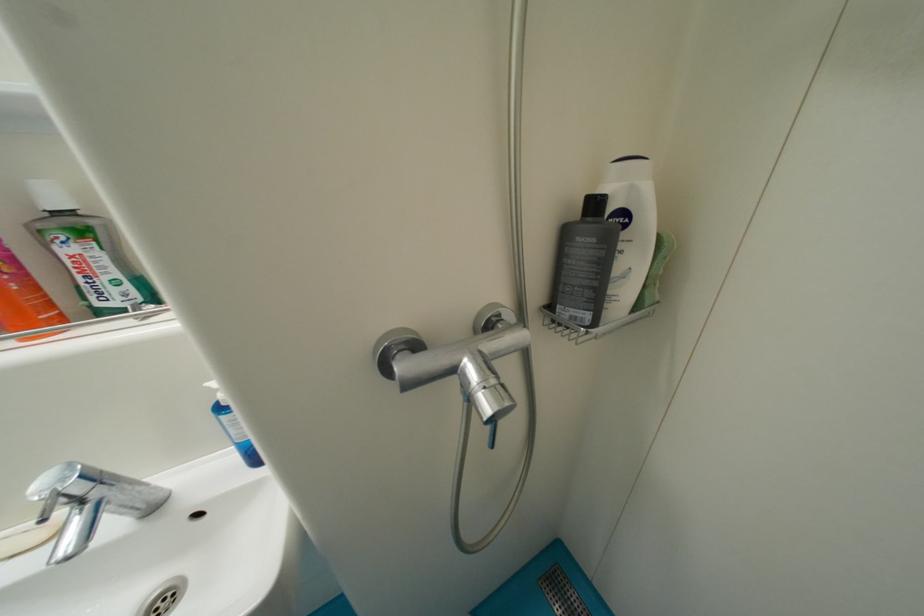
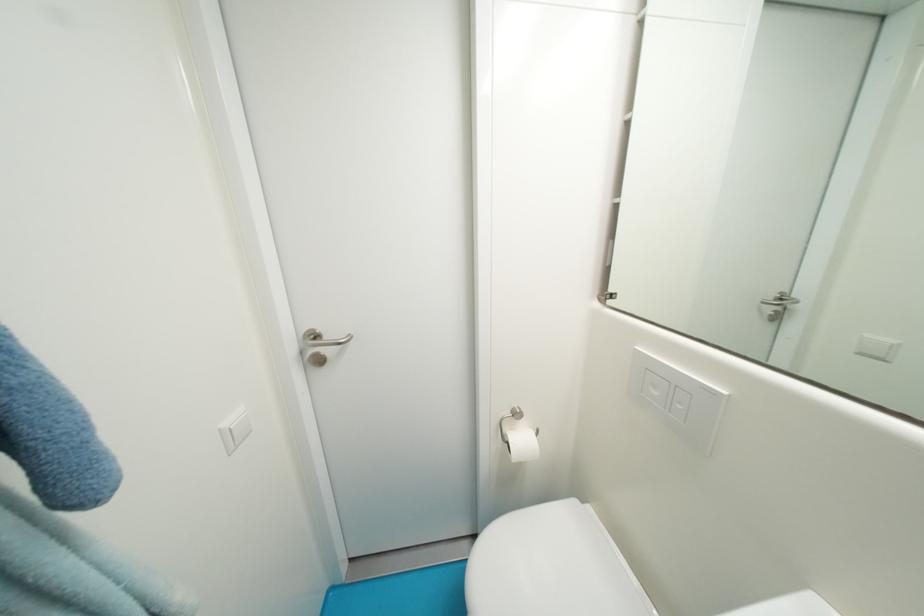
The first image is from the beginning of the video and the second image is from the end. How did the camera likely rotate when shooting the video?

The rotation direction of the camera is left-down.